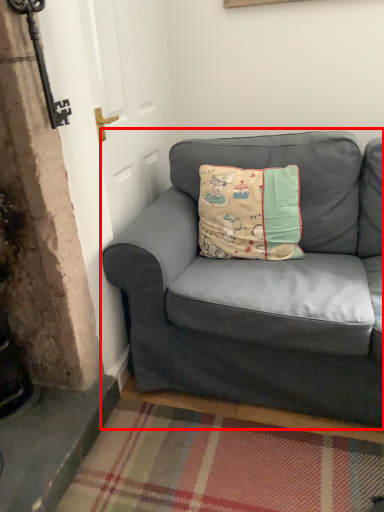
Question: From the image's perspective, what is the correct spatial positioning of studio couch (annotated by the red box) in reference to pillow?

Choices:
 (A) above
 (B) below

Answer: (B)